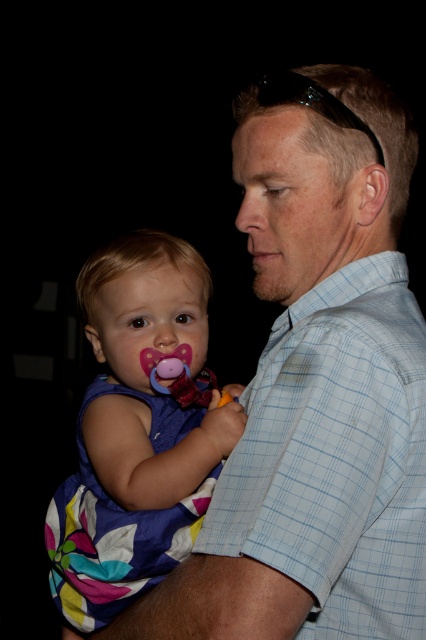
Is point (336, 376) behind point (178, 465)?

No, (336, 376) is closer to viewer.

Looking at this image, does light blue checkered shirt at center have a lesser width compared to multicolored fabric dress at left?

No, light blue checkered shirt at center is not thinner than multicolored fabric dress at left.

Which is in front, point (319, 627) or point (85, 292)?

Positioned in front is point (319, 627).

Locate an element on the screen. This screenshot has height=640, width=426. light blue checkered shirt at center is located at coordinates (316, 394).